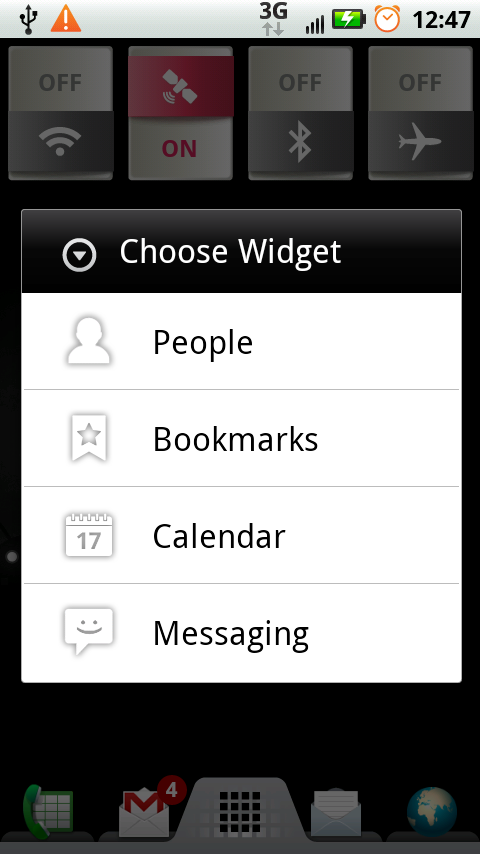
The width and height of the screenshot is (480, 854). Identify the location of alarm. (386, 19).